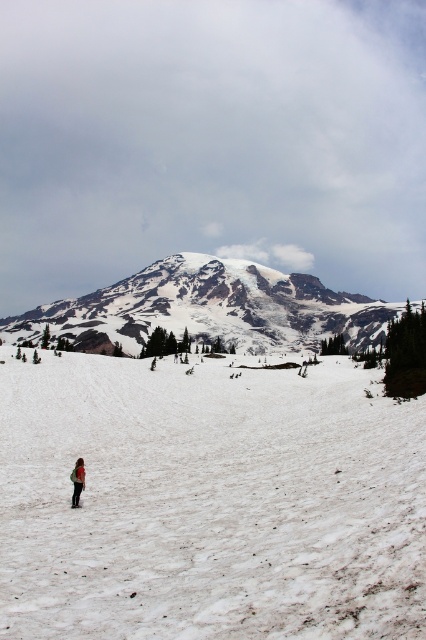
Question: Is white snow-covered mountain at center wider than red fabric jacket at lower left?

Choices:
 (A) yes
 (B) no

Answer: (A)

Question: Which object is positioned closest to the white snow at lower center?

Choices:
 (A) red fabric jacket at lower left
 (B) white snow-covered mountain at center

Answer: (A)

Question: Can you confirm if white snow-covered mountain at center is positioned to the right of red fabric jacket at lower left?

Choices:
 (A) no
 (B) yes

Answer: (A)

Question: Which of the following is the farthest from the observer?

Choices:
 (A) red fabric jacket at lower left
 (B) white snow at lower center
 (C) white snow-covered mountain at center

Answer: (C)

Question: Is white snow at lower center above red fabric jacket at lower left?

Choices:
 (A) no
 (B) yes

Answer: (B)

Question: Which of these objects is positioned farthest from the red fabric jacket at lower left?

Choices:
 (A) white snow at lower center
 (B) white snow-covered mountain at center

Answer: (B)